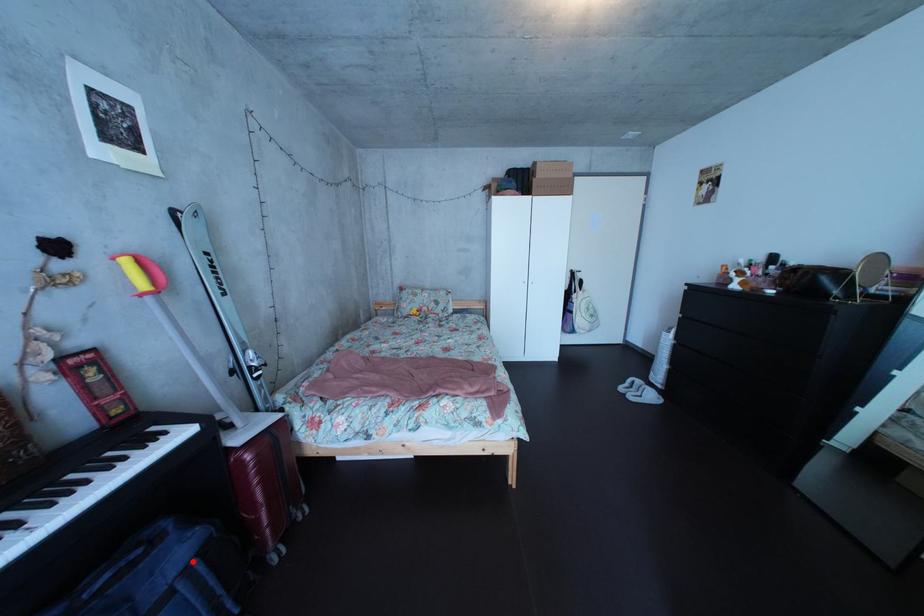
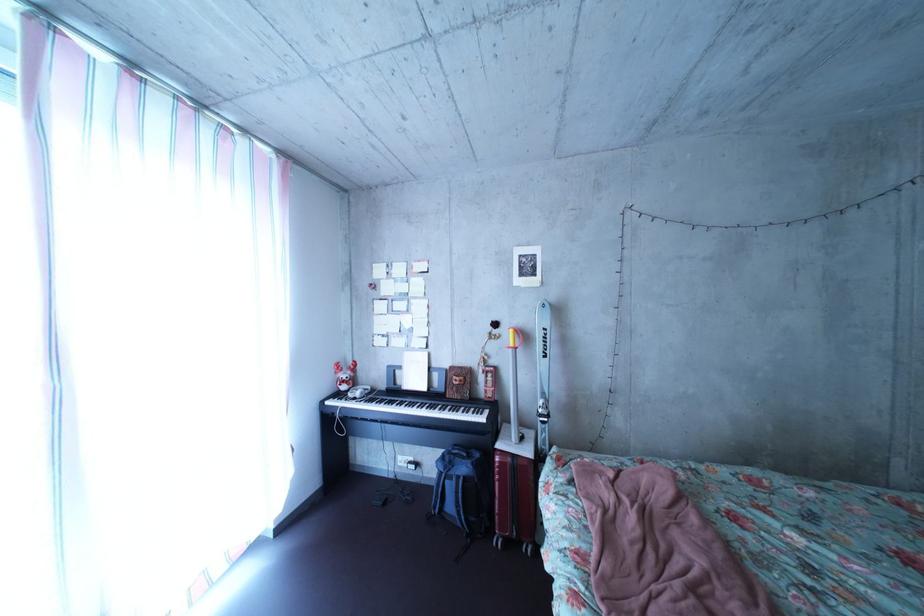
Question: I am providing you with two images of the same scene from different viewpoints. A red point is marked on the first image. Can you still see the location of the red point in image 2?

Choices:
 (A) Yes
 (B) No

Answer: (A)